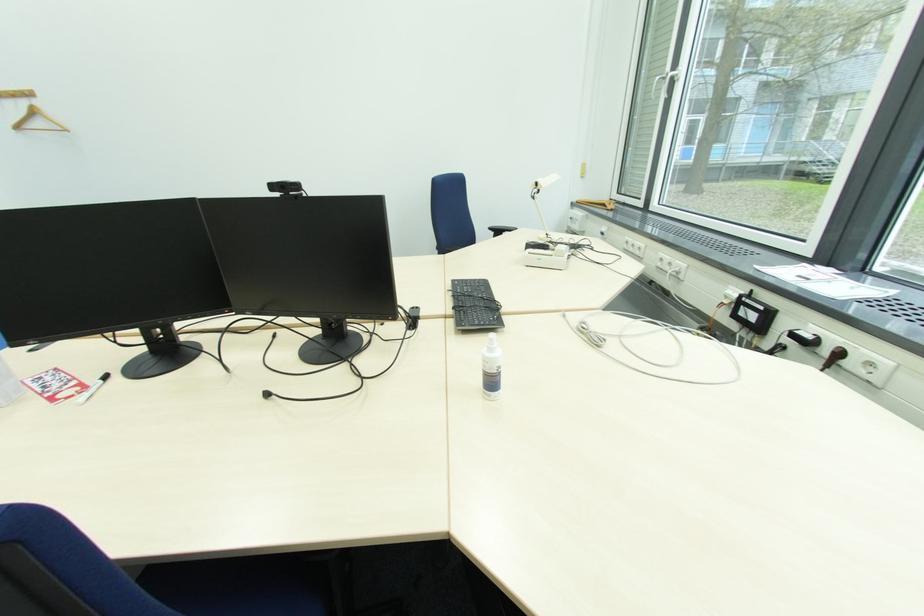
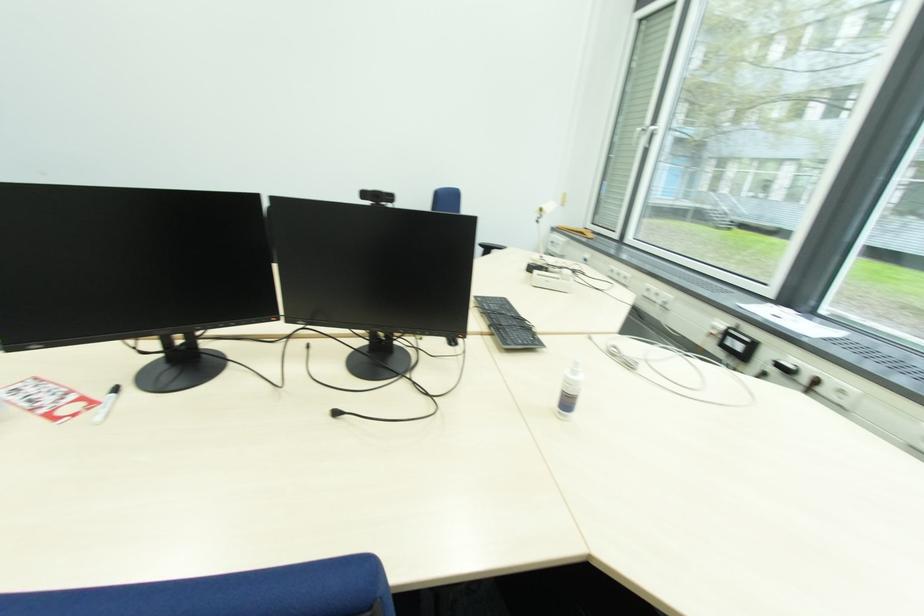
Find the pixel in the second image that matches (110,379) in the first image.

(118, 392)